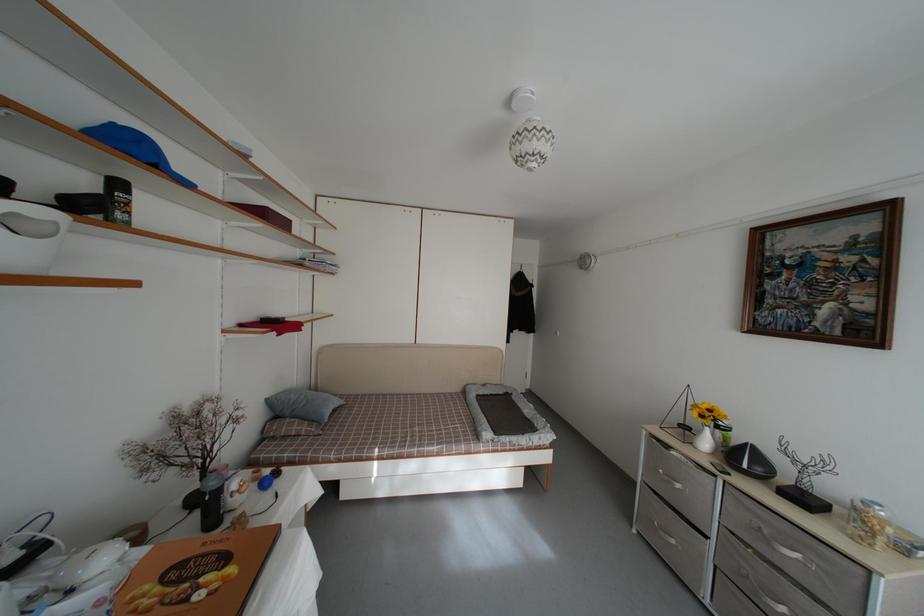
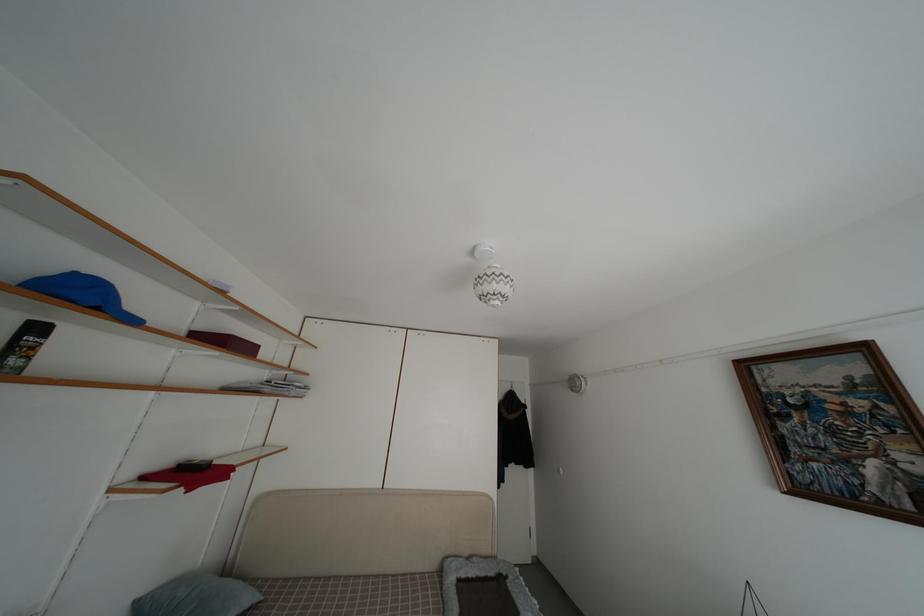
Locate, in the second image, the point that corresponds to (274,407) in the first image.

(142, 610)